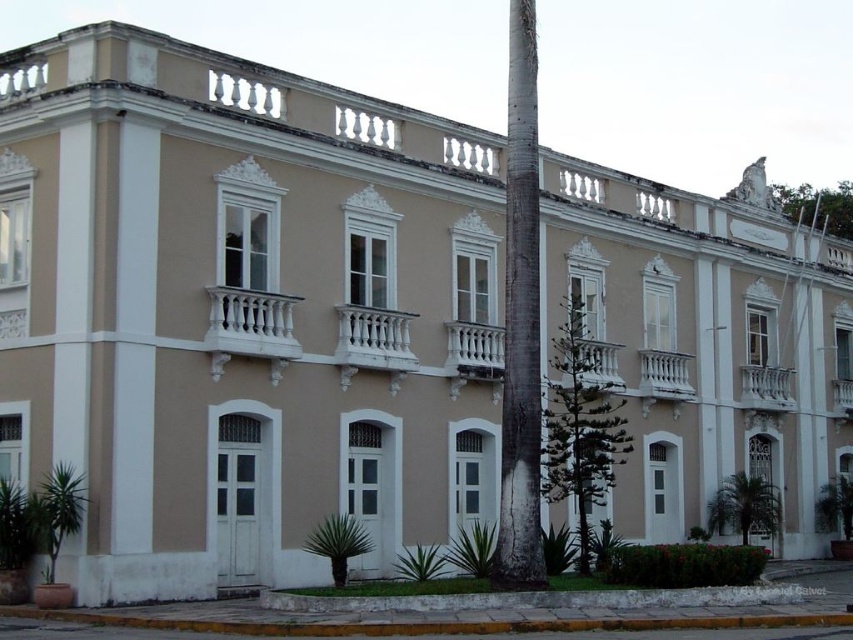
Question: Does green leafy palm tree at lower right appear on the left side of green leafy palm tree at lower center?

Choices:
 (A) no
 (B) yes

Answer: (A)

Question: Which object is the closest to the green textured tree at center?

Choices:
 (A) smooth gray bark at center
 (B) green leafy palm tree at lower left

Answer: (A)

Question: Does green textured tree at center appear on the left side of green leafy palm tree at lower center?

Choices:
 (A) no
 (B) yes

Answer: (A)

Question: Is green textured tree at center to the right of green leafy palm tree at lower right from the viewer's perspective?

Choices:
 (A) yes
 (B) no

Answer: (B)

Question: Which of the following is the closest to the observer?

Choices:
 (A) green textured tree at center
 (B) green leafy tree at upper right

Answer: (A)

Question: Which object appears farthest from the camera in this image?

Choices:
 (A) green leafy palm tree at lower right
 (B) green leafy palm tree at lower left

Answer: (A)